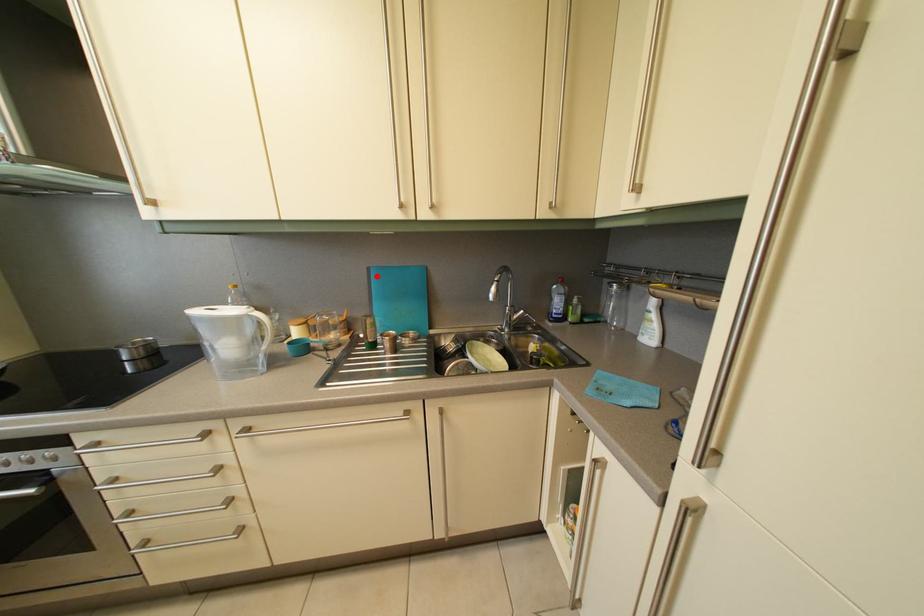
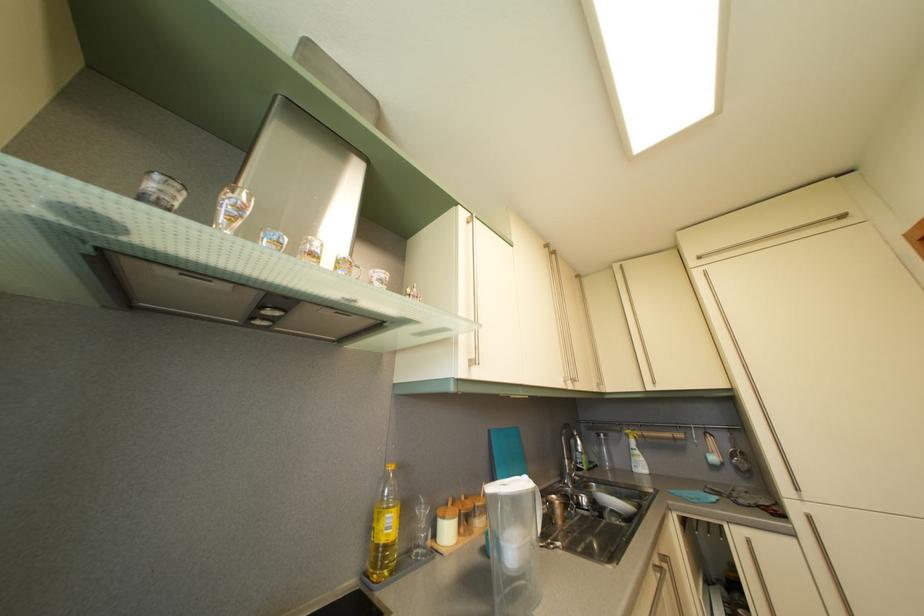
The point at the highlighted location is marked in the first image. Where is the corresponding point in the second image?

(497, 439)